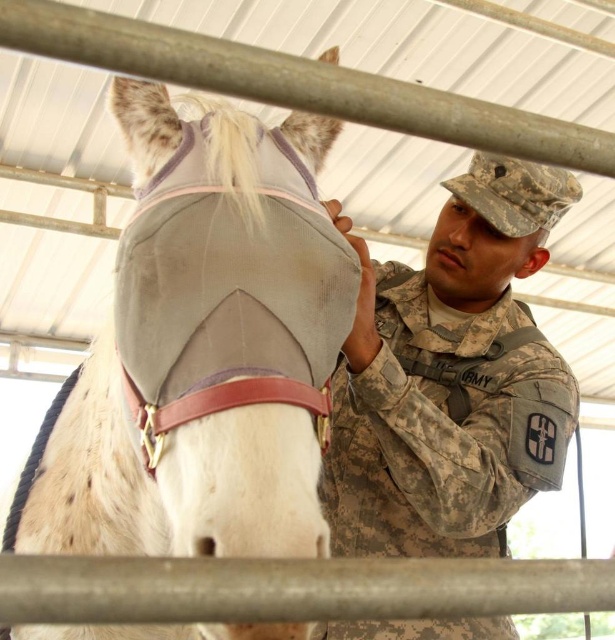
Question: Estimate the real-world distances between objects in this image. Which object is closer to the gray fabric horse mask at center?

Choices:
 (A) camouflage uniform at center
 (B) camouflage fabric cap at upper right
 (C) smooth skin nose at center

Answer: (A)

Question: Can you confirm if camouflage uniform at center is positioned to the right of smooth skin nose at center?

Choices:
 (A) yes
 (B) no

Answer: (B)

Question: Is camouflage uniform at center above smooth skin nose at center?

Choices:
 (A) no
 (B) yes

Answer: (A)

Question: Which point is farther from the camera taking this photo?

Choices:
 (A) (462, 236)
 (B) (502, 179)

Answer: (A)

Question: Is the position of gray fabric horse mask at center less distant than that of camouflage fabric cap at upper right?

Choices:
 (A) no
 (B) yes

Answer: (B)

Question: Based on their relative distances, which object is nearer to the smooth skin nose at center?

Choices:
 (A) gray fabric horse mask at center
 (B) camouflage uniform at center

Answer: (B)